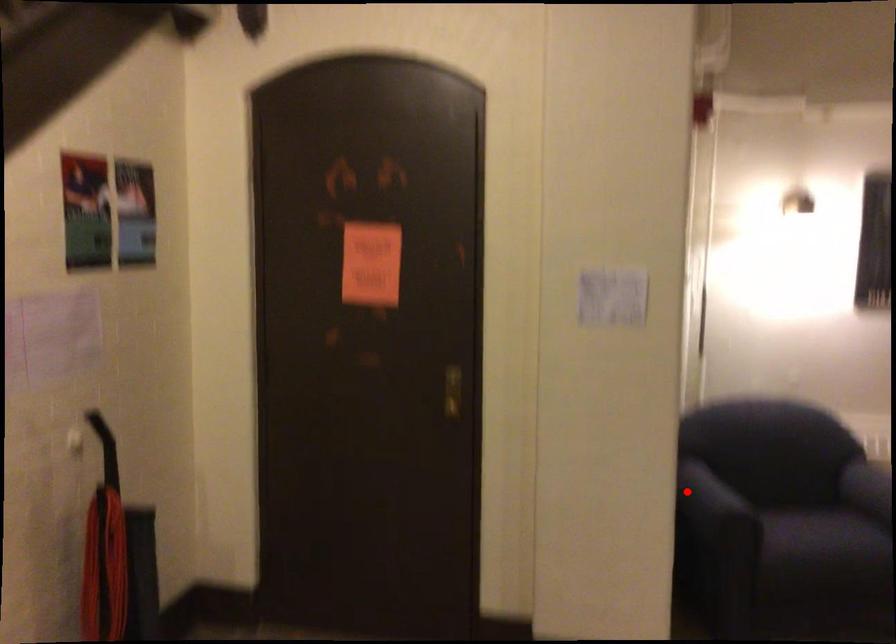
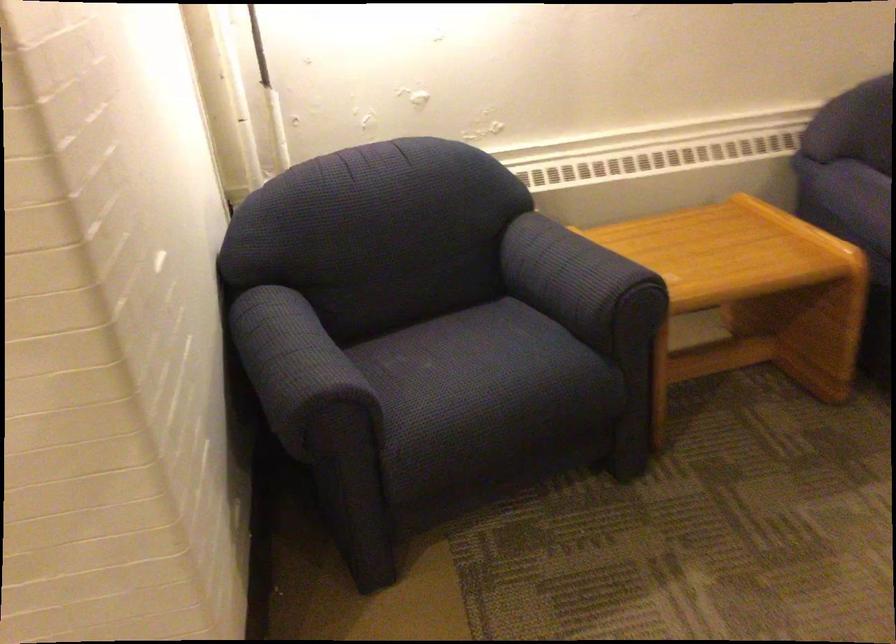
Question: I am providing you with two images of the same scene from different viewpoints. Image1 has a red point marked. In image2, the corresponding 3D location appears at what relative position? Reply with the corresponding letter.

Choices:
 (A) Closer
 (B) Farther

Answer: (A)